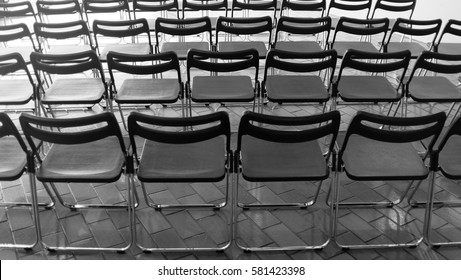
Where is `chair feet`? The image size is (461, 280). chair feet is located at coordinates (160, 250), (107, 205), (432, 240), (50, 246).